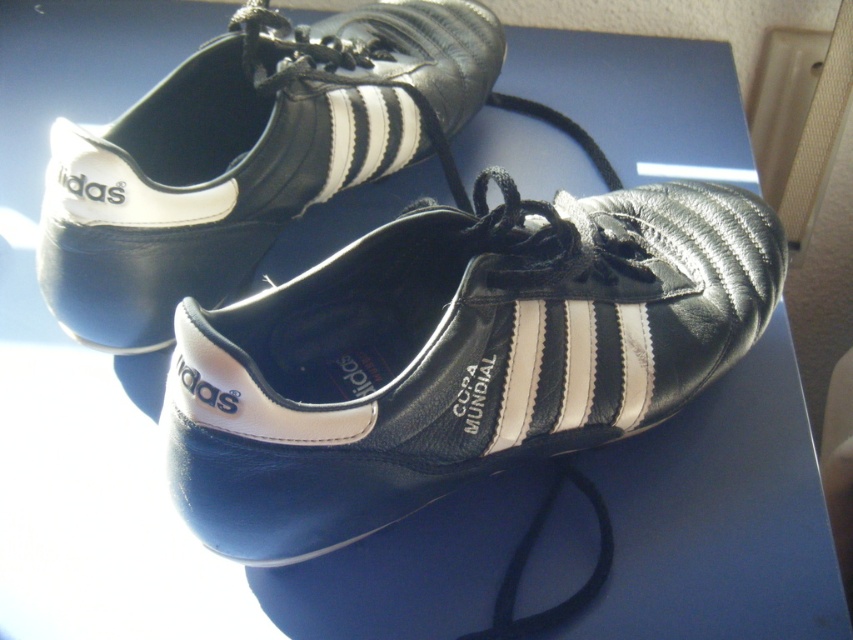
You are standing in a room and see the black leather shoe at center and the shiny leather shoe at upper center. Which shoe is positioned closer to you?

The black leather shoe at center is closer to the viewer than the shiny leather shoe at upper center.

You are a soccer player looking at the Adidas Copa Mundial shoes. You notice two shoes in the image. Which shoe is more to the right, the black leather shoe at center or the shiny leather shoe at upper center?

The black leather shoe at center is positioned on the right side of the shiny leather shoe at upper center, so the black leather shoe at center is more to the right.

You are standing in a room and see the Adidas Copa Mundial soccer cleats on the blue surface. There is a point at coordinates point (x=231, y=436). If you want to touch that point with a 36 inch long stick, will the stick be long enough?

The point (x=231, y=436) is 37.32 inches from the camera. The stick is only 36 inches long, so it will not be long enough to reach the point.